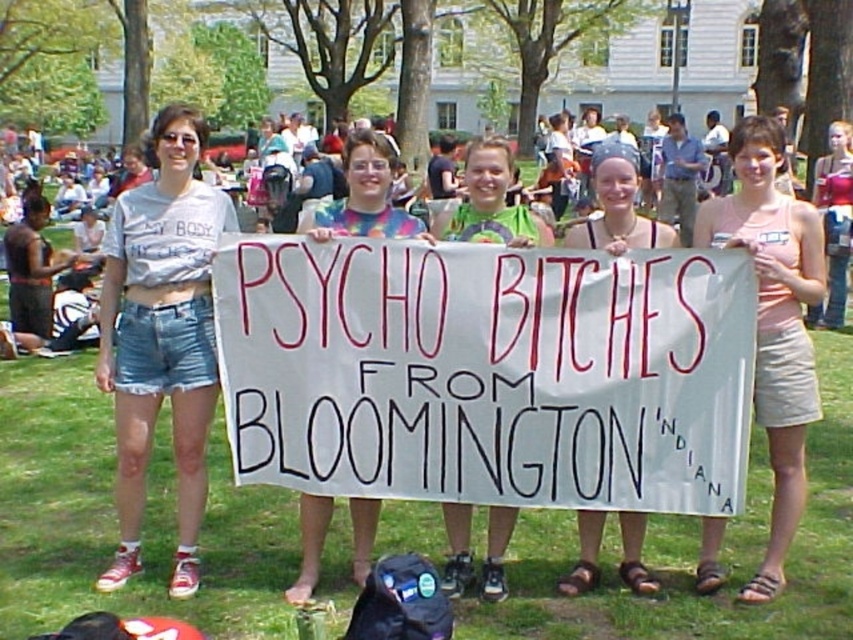
Question: Which point is farther to the camera?

Choices:
 (A) green jersey at center
 (B) matte white sign at center
 (C) denim shorts at center
 (D) white paper banner at center

Answer: (C)

Question: Does multicolored tie-dye shirt at center appear on the right side of matte white sign at center?

Choices:
 (A) no
 (B) yes

Answer: (A)

Question: Does white paper banner at center have a lesser width compared to denim shorts at center?

Choices:
 (A) no
 (B) yes

Answer: (A)

Question: Does multicolored tie-dye shirt at center appear under matte white sign at center?

Choices:
 (A) no
 (B) yes

Answer: (B)

Question: Which point is closer to the camera?

Choices:
 (A) (514, 259)
 (B) (482, 195)
 (C) (374, 172)
 (D) (608, 161)

Answer: (A)

Question: Among these objects, which one is nearest to the camera?

Choices:
 (A) multicolored tie-dye shirt at center
 (B) denim shorts at left
 (C) matte white sign at center
 (D) green jersey at center

Answer: (D)